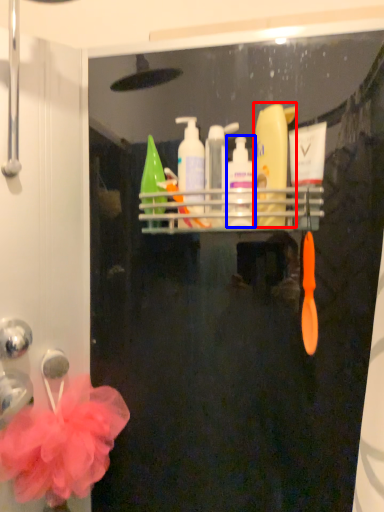
Question: Which object is closer to the camera taking this photo, cleaning product (highlighted by a red box) or cleaning product (highlighted by a blue box)?

Choices:
 (A) cleaning product
 (B) cleaning product

Answer: (A)